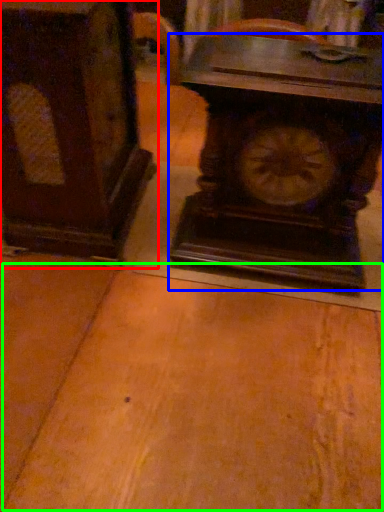
Question: Which object is the farthest from furniture (highlighted by a red box)? Choose among these: wall clock (highlighted by a blue box) or table (highlighted by a green box).

Choices:
 (A) wall clock
 (B) table

Answer: (B)